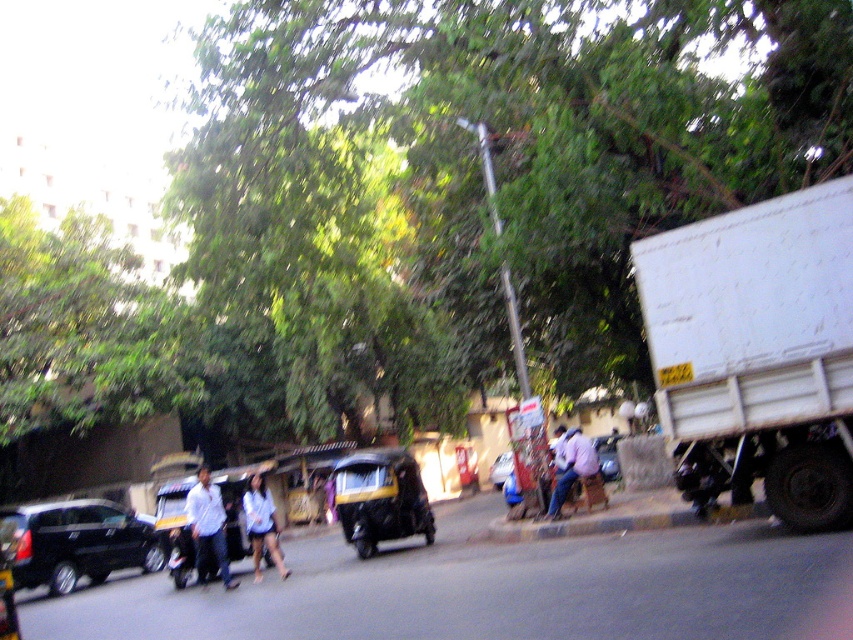
Question: Which object appears closest to the camera in this image?

Choices:
 (A) shiny black car at left
 (B) light pink shirt at center
 (C) green leafy tree at upper center

Answer: (C)

Question: Can you confirm if white matte truck at right is positioned to the right of light pink shirt at center?

Choices:
 (A) no
 (B) yes

Answer: (A)

Question: Which point is closer to the camera?

Choices:
 (A) shiny black car at left
 (B) matte black car at center
 (C) white shirt at center
 (D) light blue shirt at center

Answer: (C)

Question: Among these objects, which one is nearest to the camera?

Choices:
 (A) light pink shirt at center
 (B) light blue shirt at center
 (C) white shirt at center
 (D) white matte truck at right

Answer: (D)

Question: Does white shirt at center appear over light pink shirt at center?

Choices:
 (A) yes
 (B) no

Answer: (B)

Question: Observing the image, what is the correct spatial positioning of white matte truck at right in reference to shiny black car at left?

Choices:
 (A) above
 (B) below

Answer: (A)